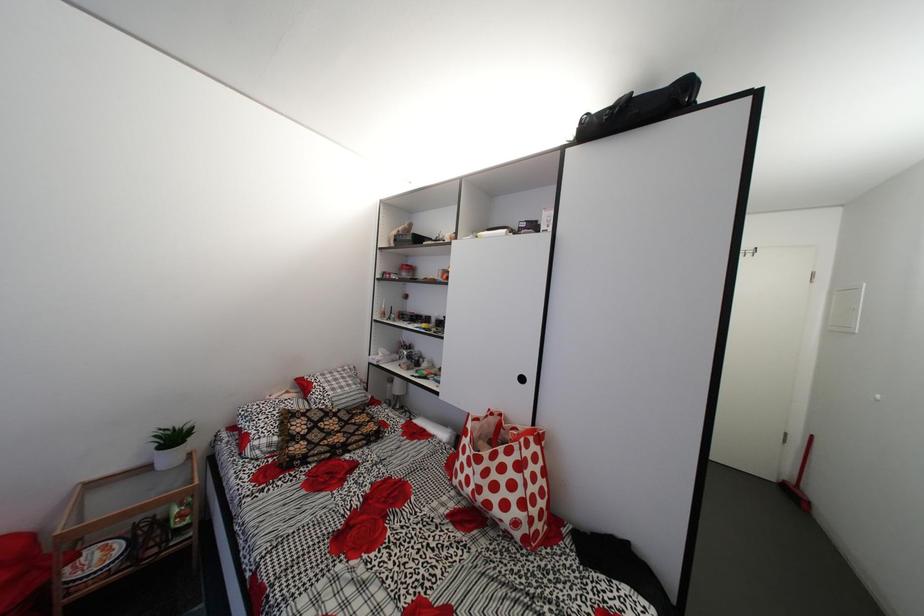
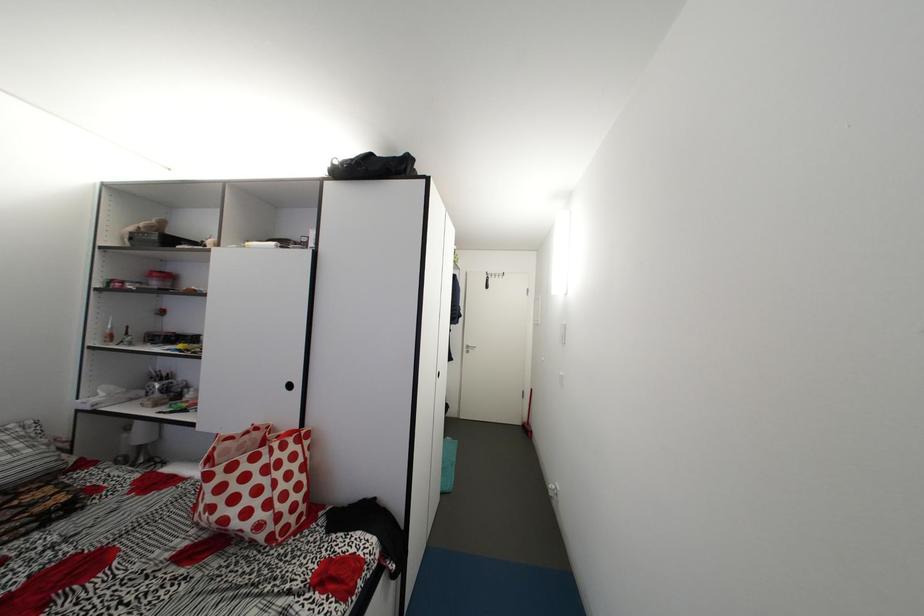
Question: The camera is either moving clockwise (left) or counter-clockwise (right) around the object. The first image is from the beginning of the video and the second image is from the end. Is the camera moving left or right when shooting the video?

Choices:
 (A) Left
 (B) Right

Answer: (A)